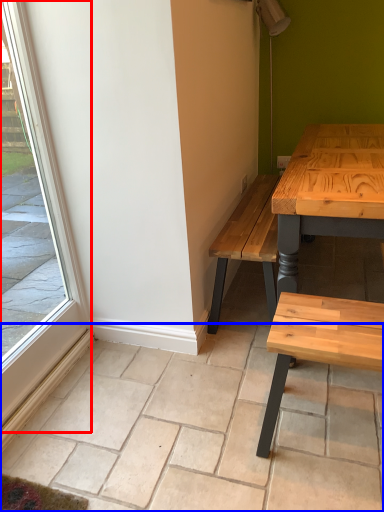
Question: Which of the following is the farthest to the observer, window (highlighted by a red box) or tile (highlighted by a blue box)?

Choices:
 (A) window
 (B) tile

Answer: (B)